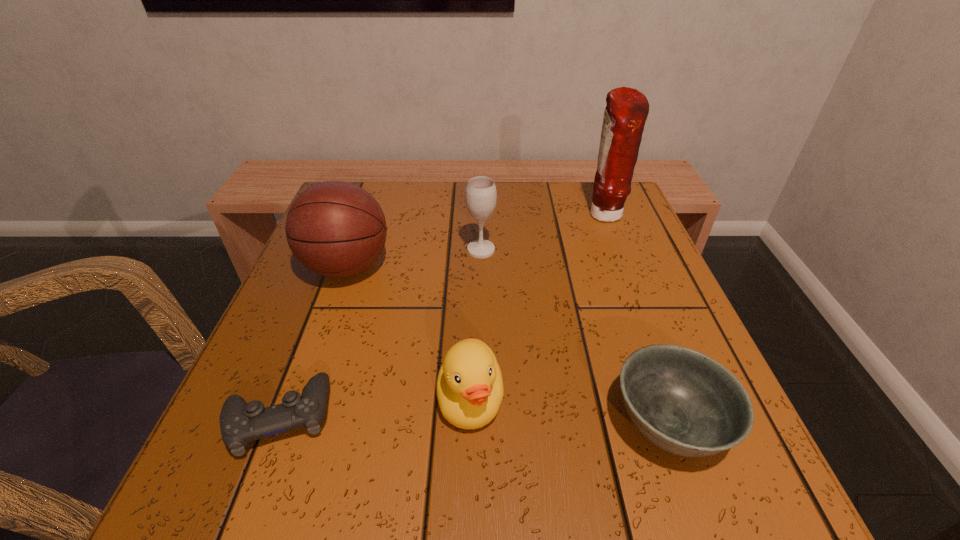
Identify the location of vacant space that is in between the wineglass and the shortest object. Image resolution: width=960 pixels, height=540 pixels. (380, 333).

Identify the location of free space between the wineglass and the tallest object. This screenshot has width=960, height=540. (542, 232).

This screenshot has height=540, width=960. I want to click on vacant point located between the farthest object and the bowl, so click(636, 319).

Locate an element on the screen. free space between the basketball and the shortest object is located at coordinates coord(313,342).

Locate an element on the screen. The height and width of the screenshot is (540, 960). empty space between the wineglass and the basketball is located at coordinates (414, 258).

The image size is (960, 540). What are the coordinates of `object that is the fifth closest one to the control` in the screenshot? It's located at (627, 109).

I want to click on object that is the nearest to the tallest object, so click(481, 195).

Where is `free space that satisfies the following two spatial constraints: 1. at the beak of the second shortest object; 2. on the right side of the fourth tallest object`? This screenshot has height=540, width=960. free space that satisfies the following two spatial constraints: 1. at the beak of the second shortest object; 2. on the right side of the fourth tallest object is located at coordinates (470, 423).

Find the location of `vacant area that satisfies the following two spatial constraints: 1. on the front side of the second shortest object; 2. on the left side of the wineglass`. vacant area that satisfies the following two spatial constraints: 1. on the front side of the second shortest object; 2. on the left side of the wineglass is located at coordinates (482, 423).

Identify the location of free spot that satisfies the following two spatial constraints: 1. at the beak of the bowl; 2. on the left side of the duck. Image resolution: width=960 pixels, height=540 pixels. (470, 423).